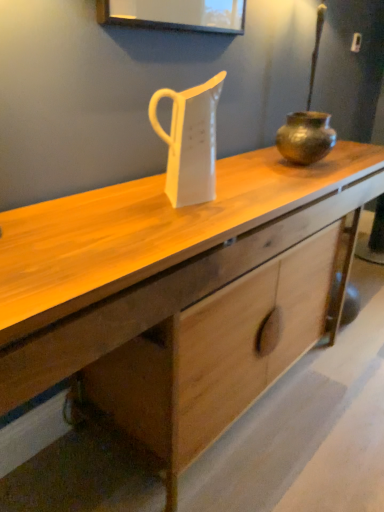
Identify the location of unoccupied region to the right of white glossy jug at center. (244, 202).